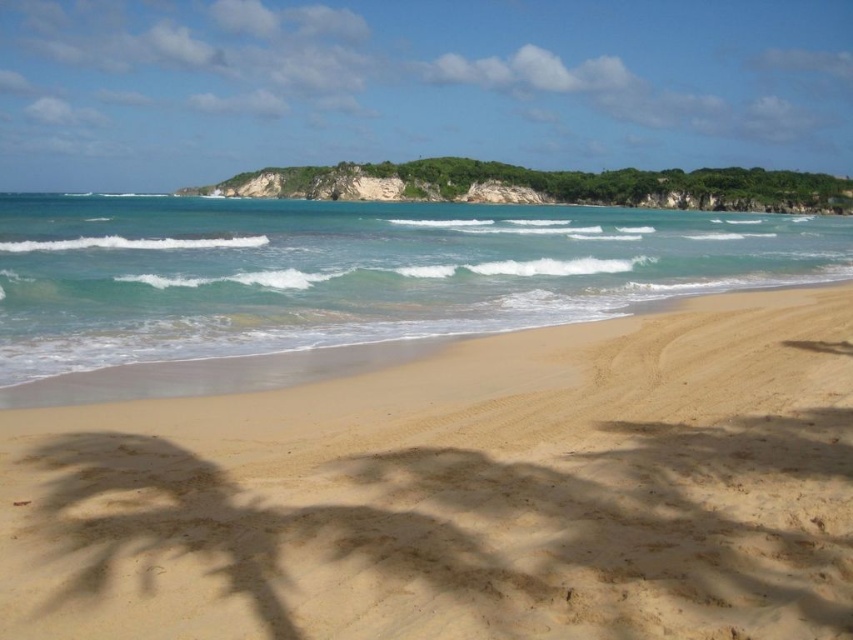
Is point (546, 406) positioned after point (416, 172)?

No, it is not.

Describe the element at coordinates (462, 492) in the screenshot. This screenshot has width=853, height=640. I see `golden sand at center` at that location.

At what (x,y) coordinates should I click in order to perform the action: click on golden sand at center. Please return your answer as a coordinate pair (x, y). The image size is (853, 640). Looking at the image, I should click on (462, 492).